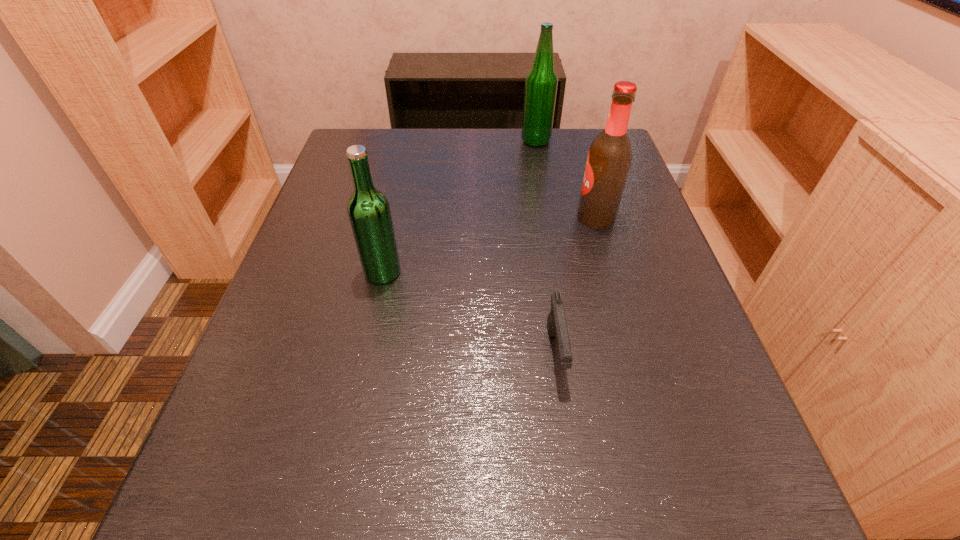
Find the location of `free region located on the label of the second beer bottle from left to right`. free region located on the label of the second beer bottle from left to right is located at coordinates (393, 141).

Locate an element on the screen. free space located 0.150m on the label of the second beer bottle from left to right is located at coordinates (465, 141).

Identify the location of vacant space positioned 0.260m on the back of the leftmost object. This screenshot has height=540, width=960. (402, 183).

You are a GUI agent. You are given a task and a screenshot of the screen. Output one action in this format:
    pyautogui.click(x=<x>, y=<y>)
    Task: Click on the free space located at the barrel of the nearest object
    This screenshot has width=960, height=540.
    Given the screenshot: What is the action you would take?
    pyautogui.click(x=574, y=488)

Identify the location of object positioned at the far edge. This screenshot has width=960, height=540. (541, 82).

Where is `object at the left edge`? object at the left edge is located at coordinates (369, 212).

Locate an element on the screen. Image resolution: width=960 pixels, height=540 pixels. object present at the right edge is located at coordinates (609, 158).

I want to click on vacant space at the far edge of the desktop, so click(543, 162).

In the image, there is a desktop. At what (x,y) coordinates should I click in order to perform the action: click on vacant space at the left edge. Please return your answer as a coordinate pair (x, y). This screenshot has width=960, height=540. Looking at the image, I should click on (257, 374).

Identify the location of vacant space at the right edge of the desktop. (617, 274).